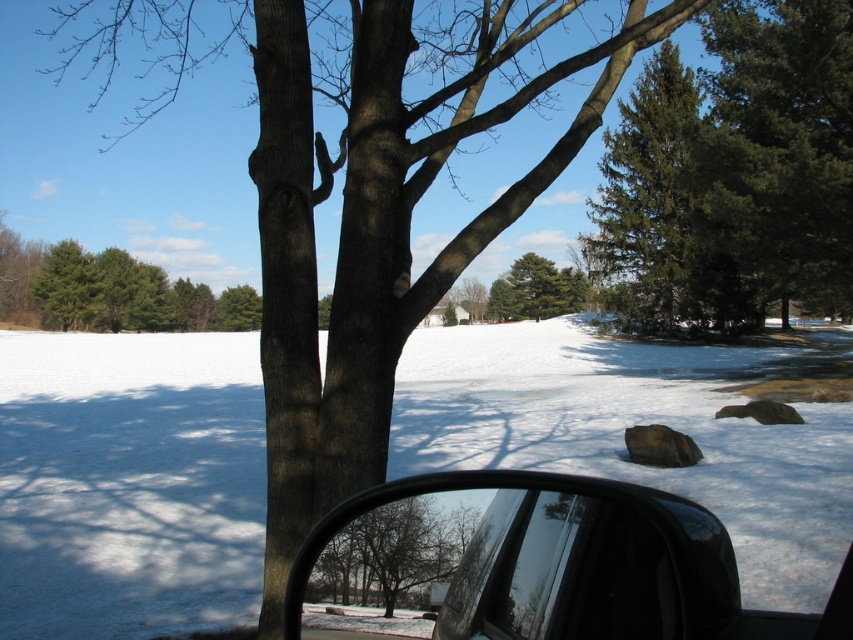
Does white powdery snow at center have a smaller size compared to green matte tree at center?

Actually, white powdery snow at center might be larger than green matte tree at center.

Identify the location of white powdery snow at center. (128, 483).

This screenshot has height=640, width=853. Identify the location of white powdery snow at center. (128, 483).

You are a GUI agent. You are given a task and a screenshot of the screen. Output one action in this format:
    pyautogui.click(x=<x>, y=<y>)
    Task: Click on the white powdery snow at center
    This screenshot has width=853, height=640.
    Given the screenshot: What is the action you would take?
    pyautogui.click(x=128, y=483)

Is green textured pine tree at upper right closer to the viewer compared to green matte tree at center?

Yes, it is in front of green matte tree at center.

Who is positioned more to the left, green textured pine tree at upper right or green matte tree at center?

green matte tree at center is more to the left.

This screenshot has height=640, width=853. What are the coordinates of `green textured pine tree at upper right` in the screenshot? It's located at (780, 145).

Between green textured pine tree at upper right and green matte tree at upper left, which one has more height?

green textured pine tree at upper right is taller.

This screenshot has width=853, height=640. In order to click on green textured pine tree at upper right in this screenshot , I will do `click(780, 145)`.

Find the location of a particular element. The image size is (853, 640). green textured pine tree at upper right is located at coordinates (780, 145).

I want to click on green textured pine tree at upper right, so click(780, 145).